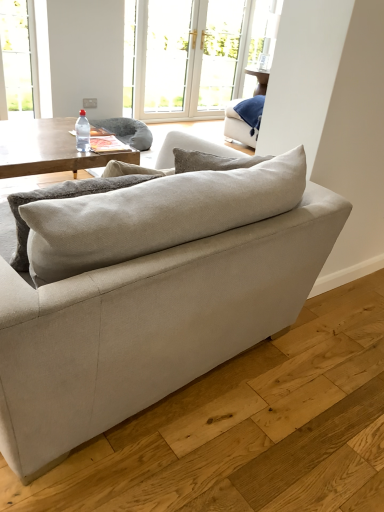
You are a GUI agent. You are given a task and a screenshot of the screen. Output one action in this format:
    pyautogui.click(x=<x>, y=<y>)
    Task: Click on the vacant space that is to the left of transparent plastic bottle at center
    This screenshot has height=512, width=384.
    Given the screenshot: What is the action you would take?
    pyautogui.click(x=55, y=146)